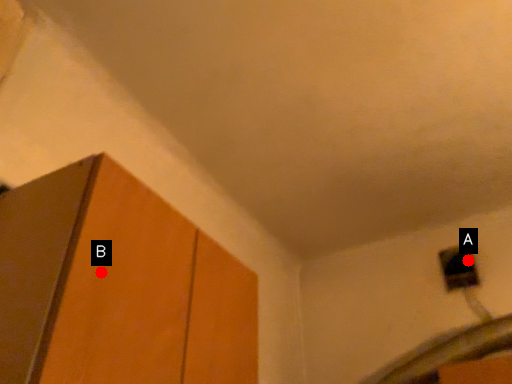
Question: Two points are circled on the image, labeled by A and B beside each circle. Which point is closer to the camera?

Choices:
 (A) A is closer
 (B) B is closer

Answer: (B)